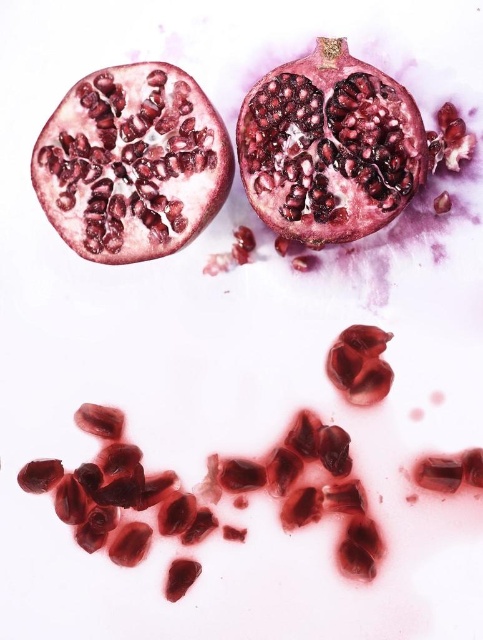
Which is more to the left, shiny red pomegranate at center or shiny red pomegranate seed at center?

Positioned to the left is shiny red pomegranate at center.

Does shiny red pomegranate at center lie in front of shiny red pomegranate seed at center?

Yes.

Locate an element on the screen. Image resolution: width=483 pixels, height=640 pixels. shiny red pomegranate at center is located at coordinates tap(329, 147).

You are a GUI agent. You are given a task and a screenshot of the screen. Output one action in this format:
    pyautogui.click(x=<x>, y=<y>)
    Task: Click on the shiny red pomegranate at center
    Image resolution: width=483 pixels, height=640 pixels.
    Given the screenshot: What is the action you would take?
    pyautogui.click(x=329, y=147)

Who is positioned more to the left, shiny red pomegranate at upper left or shiny red pomegranate seed at center?

shiny red pomegranate at upper left is more to the left.

Between shiny red pomegranate at upper left and shiny red pomegranate seed at center, which one is positioned higher?

shiny red pomegranate at upper left is higher up.

Does point (98, 193) come in front of point (381, 352)?

Yes, it is.

I want to click on shiny red pomegranate at upper left, so click(x=131, y=163).

Who is taller, shiny red pomegranate at upper left or shiny red pomegranate at center?

With more height is shiny red pomegranate at center.

Does shiny red pomegranate at upper left appear on the left side of shiny red pomegranate at center?

Indeed, shiny red pomegranate at upper left is positioned on the left side of shiny red pomegranate at center.

Measure the distance between point (x=99, y=244) and camera.

Point (x=99, y=244) is 4.16 feet away from camera.

The width and height of the screenshot is (483, 640). Identify the location of shiny red pomegranate at upper left. (131, 163).